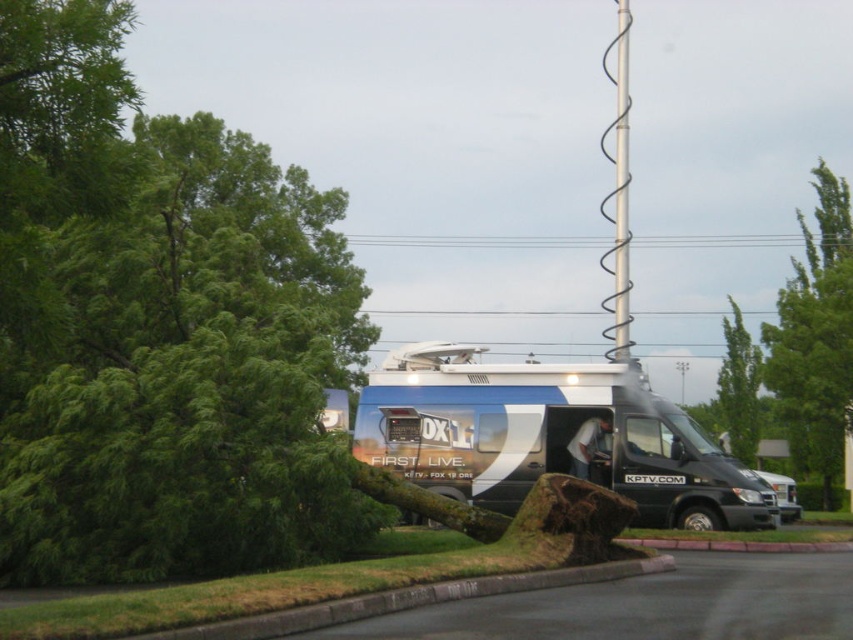
Which is below, metallic silver van at center or spiral wire at upper center?

metallic silver van at center is below.

Does metallic silver van at center come in front of spiral wire at upper center?

That is True.

Does point (469, 412) come farther from viewer compared to point (624, 228)?

That is False.

At what (x,y) coordinates should I click in order to perform the action: click on metallic silver van at center. Please return your answer as a coordinate pair (x, y). Looking at the image, I should click on (549, 436).

From the picture: Which is below, green leafy tree at left or metallic silver van at center?

metallic silver van at center is below.

Can you confirm if green leafy tree at left is positioned below metallic silver van at center?

No, green leafy tree at left is not below metallic silver van at center.

Which is behind, point (126, 337) or point (370, 442)?

Point (370, 442)

Find the location of a particular element. green leafy tree at left is located at coordinates (158, 326).

Can you confirm if metallic silver van at center is taller than black wire at upper center?

No, metallic silver van at center is not taller than black wire at upper center.

Can you confirm if metallic silver van at center is shorter than black wire at upper center?

Indeed, metallic silver van at center has a lesser height compared to black wire at upper center.

Between point (381, 420) and point (519, 244), which one is positioned behind?

Positioned behind is point (519, 244).

Locate an element on the screen. The image size is (853, 640). metallic silver van at center is located at coordinates (549, 436).